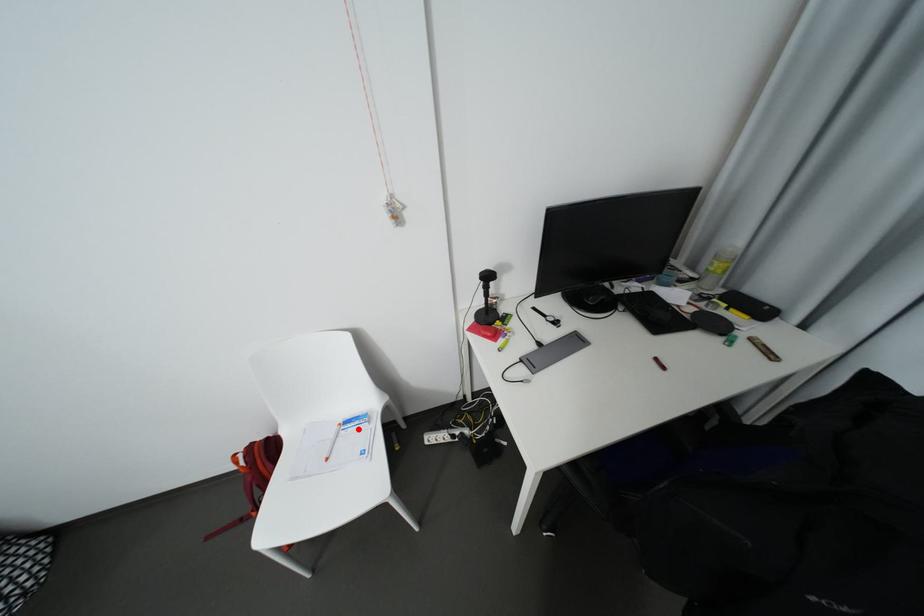
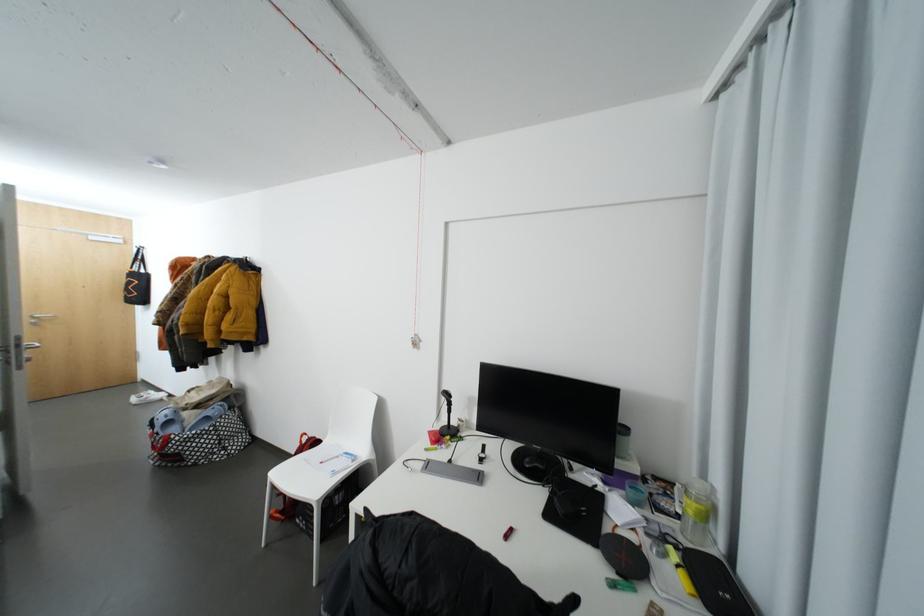
Locate, in the second image, the point that corresponds to the highlighted location in the first image.

(350, 458)